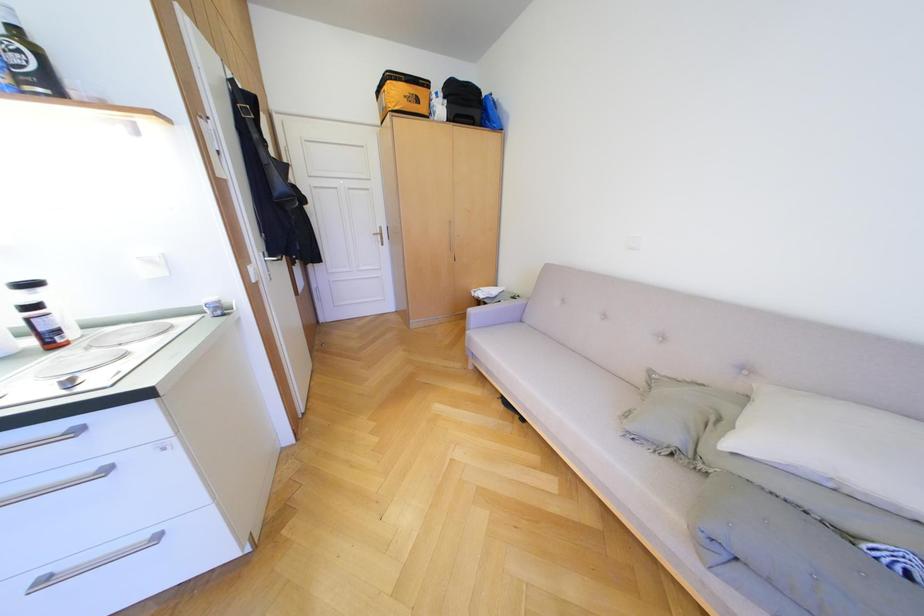
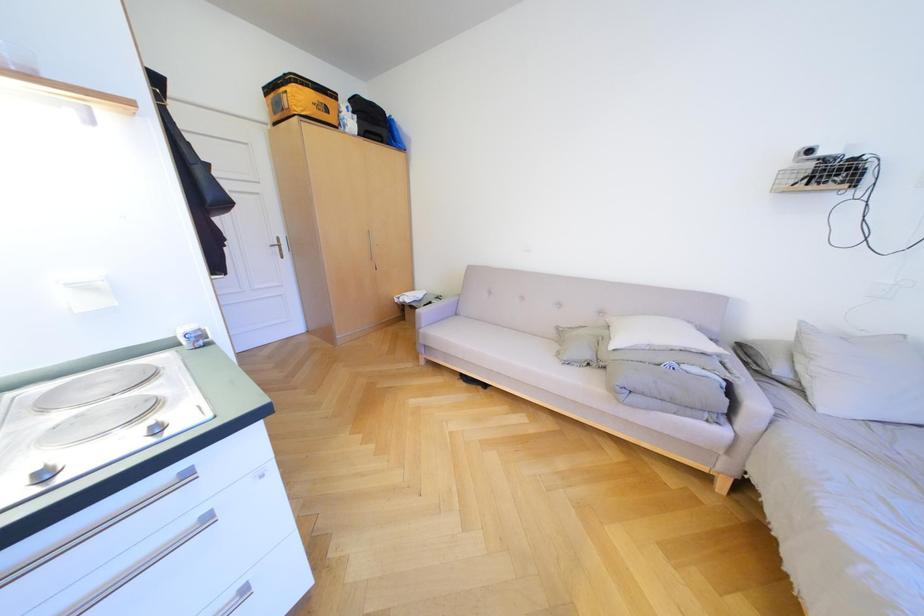
Question: How did the camera likely rotate?

Choices:
 (A) Left
 (B) Right
 (C) Up
 (D) Down

Answer: (B)